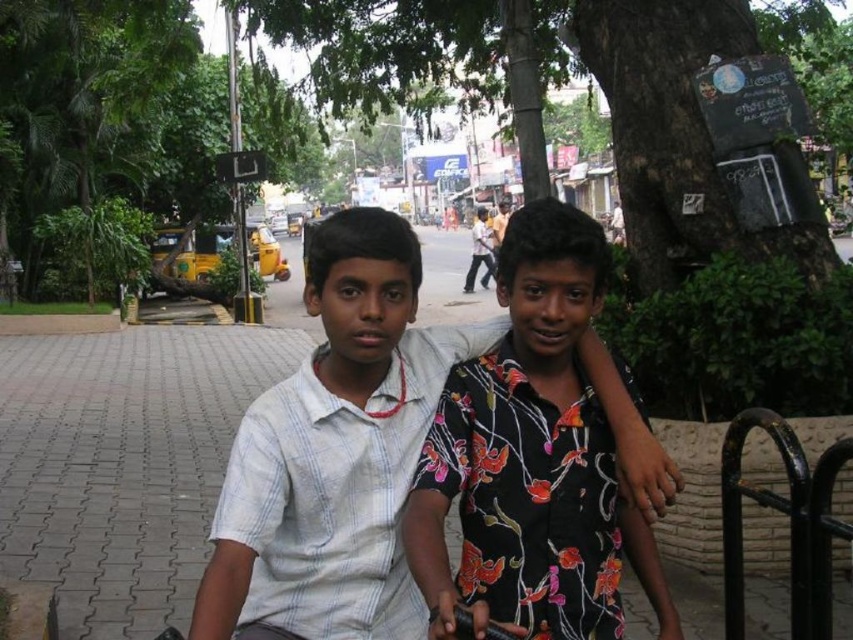
Question: Can you confirm if green leafy tree at center is wider than floral print shirt at center?

Choices:
 (A) no
 (B) yes

Answer: (B)

Question: Which point appears closest to the camera in this image?

Choices:
 (A) (468, 474)
 (B) (804, 524)
 (C) (729, 387)

Answer: (A)

Question: Which point appears closest to the camera in this image?

Choices:
 (A) coord(538,243)
 (B) coord(828,605)
 (C) coord(585,4)

Answer: (A)

Question: Does green leafy tree at center appear under black metal rail at lower right?

Choices:
 (A) yes
 (B) no

Answer: (B)

Question: Which point appears farthest from the camera in this image?

Choices:
 (A) (503, 529)
 (B) (660, 35)

Answer: (B)

Question: Is green leafy tree at center above floral print shirt at center?

Choices:
 (A) no
 (B) yes

Answer: (B)